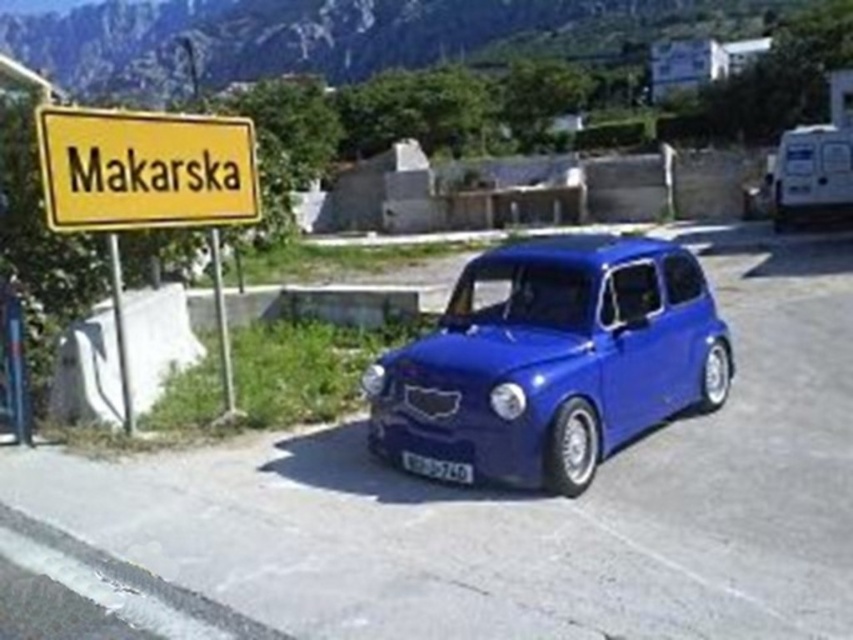
You are a photographer trying to capture the entire glossy blue car at center and the white plastic license plate at center in a single shot. Given that your camera can only focus on objects within a 100 cm height range, will both objects fit vertically in your frame?

The glossy blue car at center is larger in size than the white plastic license plate at center. Since the car is larger, it might occupy more vertical space, but without specific height measurements, we can only confirm that both can fit if their combined height doesn

You are a tourist in Makarska and want to take a photo of the glossy blue car at center and the yellow plastic sign at upper left. Which object should you position yourself to the left of to capture both in the frame?

You should position yourself to the left of the glossy blue car at center because it is to the right of the yellow plastic sign at upper left, so placing yourself to the left of the car will allow both objects to be in the frame.

You are standing in front of the vintage car and want to take a photo that includes both the car and the sign. You notice two points marked in the image. Which point is closer to you, point 1 at coordinates (59, 216) or point 2 at coordinates (438, 474)?

Point 1 at coordinates (59, 216) is closer to you than point 2 at coordinates (438, 474) because it is further to the viewer according to the description.